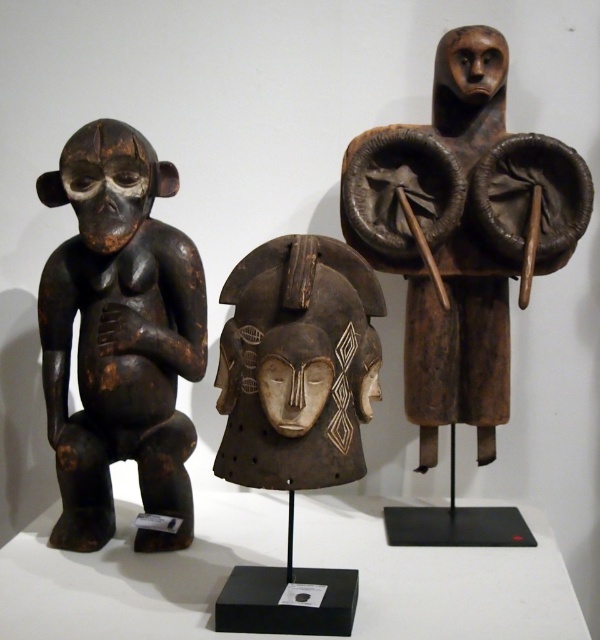
Consider the image. You are a museum curator planning to move the brown wooden figure at upper right and the dark brown wood mask at center to a new exhibition space. If you want to place them in a way that maintains their original spatial relationship, which one should be positioned closer to the visitors?

The brown wooden figure at upper right should be positioned closer to the visitors because it was originally further to the viewer than the dark brown wood mask at center.

You are an art curator planning to display the brown wooden figure at upper right and the dark brown wood mask at center in a new exhibition. Considering their sizes, which object should be placed higher to ensure both are visible to visitors?

The brown wooden figure at upper right is larger than the dark brown wood mask at center, so placing it higher would ensure both are visible without one blocking the other.

You are an art curator planning to display the dark brown wood figure at left and the dark brown wood mask at center in a new exhibition. Considering their sizes, which object should be placed on a higher pedestal to ensure both are visible to visitors standing at eye level?

The dark brown wood figure at left is taller than the dark brown wood mask at center, so placing the mask at center on a higher pedestal would balance their visibility since it is shorter.